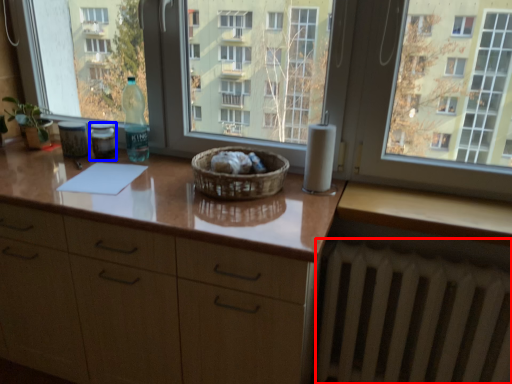
Question: Among these objects, which one is farthest to the camera, radiator (highlighted by a red box) or bottle (highlighted by a blue box)?

Choices:
 (A) radiator
 (B) bottle

Answer: (B)